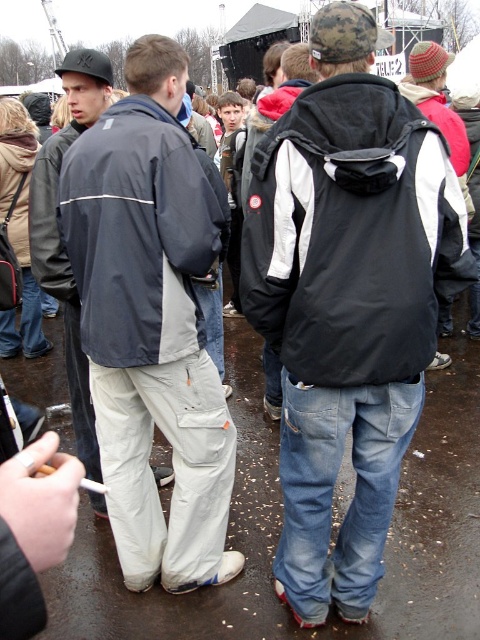
You are standing at the point marked as point (180, 276) in the image. You want to walk to the nearest exit, which is located behind the two men in the foreground. Considering your current position, how far will you have to walk to reach the exit?

The distance between you and the exit is 2.22 meters, so you will have to walk 2.22 meters to reach the exit.